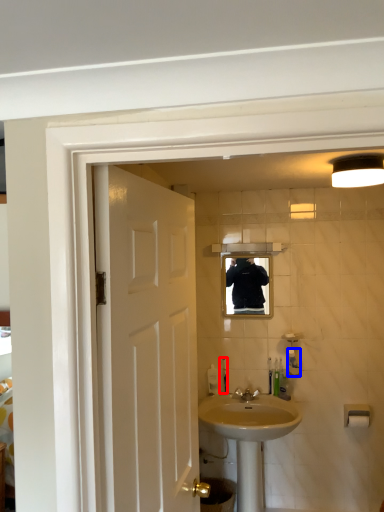
Question: Which point is closer to the camera, toiletry (highlighted by a red box) or toiletry (highlighted by a blue box)?

Choices:
 (A) toiletry
 (B) toiletry

Answer: (B)